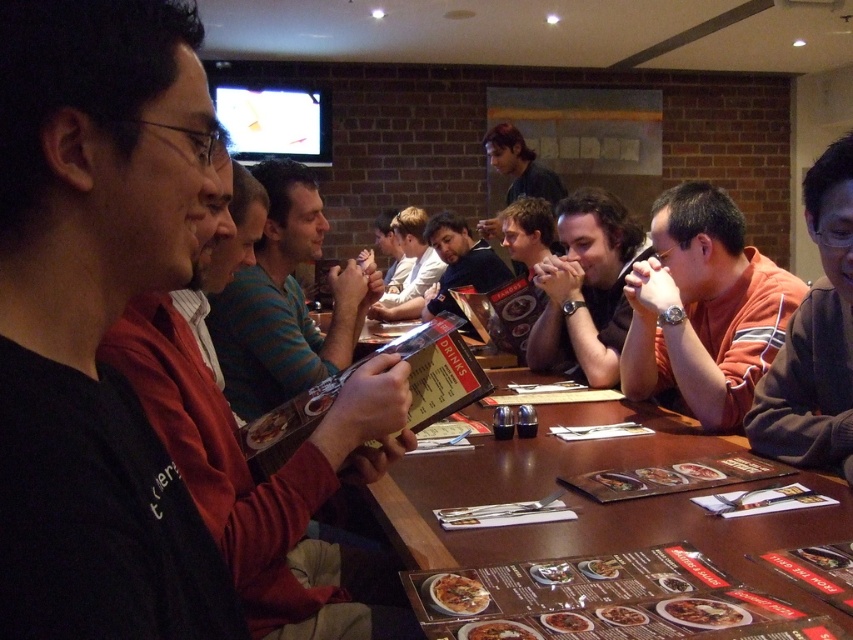
Does striped cotton shirt at center appear on the right side of dark brown sweater at center?

Incorrect, striped cotton shirt at center is not on the right side of dark brown sweater at center.

Is point (221, 353) farther from camera compared to point (828, 424)?

Yes, it is behind point (828, 424).

At what (x,y) coordinates should I click in order to perform the action: click on striped cotton shirt at center. Please return your answer as a coordinate pair (x, y). This screenshot has height=640, width=853. Looking at the image, I should click on (285, 301).

Is brown wooden table at center wider than dark brown sweater at center?

Yes.

Does brown wooden table at center appear over dark brown sweater at center?

No, brown wooden table at center is not above dark brown sweater at center.

Between point (660, 531) and point (844, 372), which one is positioned in front?

Point (660, 531) is more forward.

The width and height of the screenshot is (853, 640). I want to click on brown wooden table at center, so click(x=593, y=500).

Does black matte shirt at center appear under orange striped shirt at center?

Indeed, black matte shirt at center is positioned under orange striped shirt at center.

Between black matte shirt at center and orange striped shirt at center, which one appears on the right side from the viewer's perspective?

orange striped shirt at center is more to the right.

Find the location of a particular element. black matte shirt at center is located at coordinates 96,320.

The image size is (853, 640). I want to click on black matte shirt at center, so point(96,320).